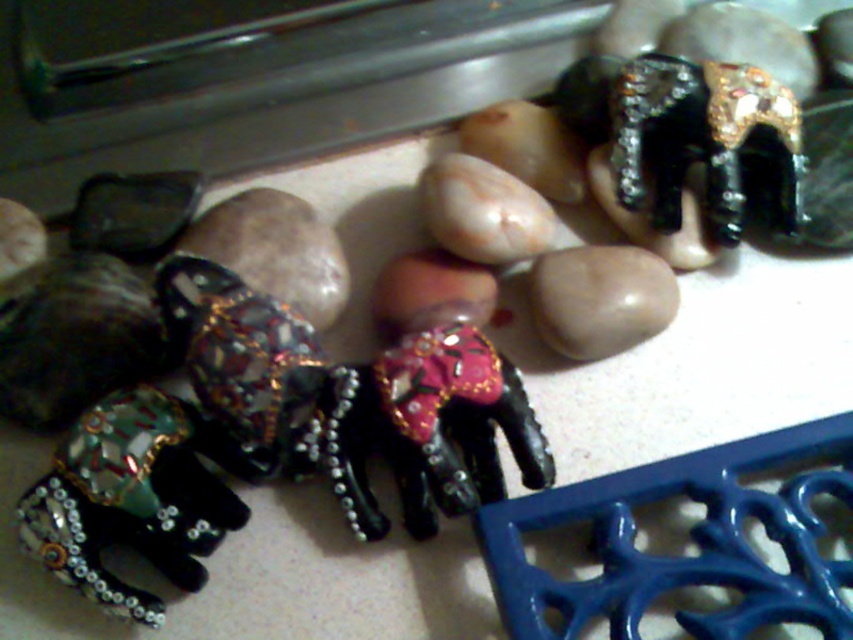
You are organizing a display of the elephants and need to place them in order from top to bottom. Which elephant should be placed higher up, the metallic beaded elephant at lower left or the black glossy elephant at center?

The black glossy elephant at center should be placed higher up because the metallic beaded elephant at lower left is below it.

You are arranging items on a shelf and need to know the vertical positions of the black glossy elephant at center and the smooth beige rock at center. Which one is placed lower?

The black glossy elephant at center is located below the smooth beige rock at center, so the black glossy elephant at center is placed lower.

You are looking at the two points in the image, point (x=456, y=368) and point (x=556, y=346). Which point is closer to you?

Point (x=456, y=368) is closer to the camera than point (x=556, y=346).